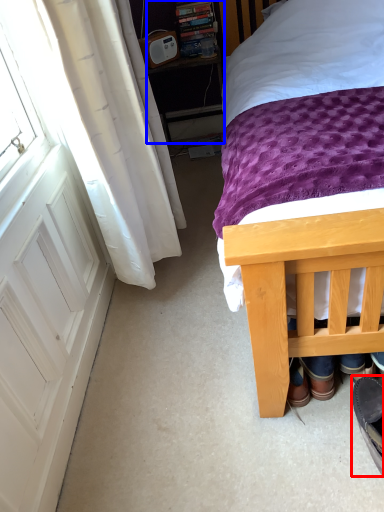
Question: Which point is closer to the camera, footwear (highlighted by a red box) or nightstand (highlighted by a blue box)?

Choices:
 (A) footwear
 (B) nightstand

Answer: (A)